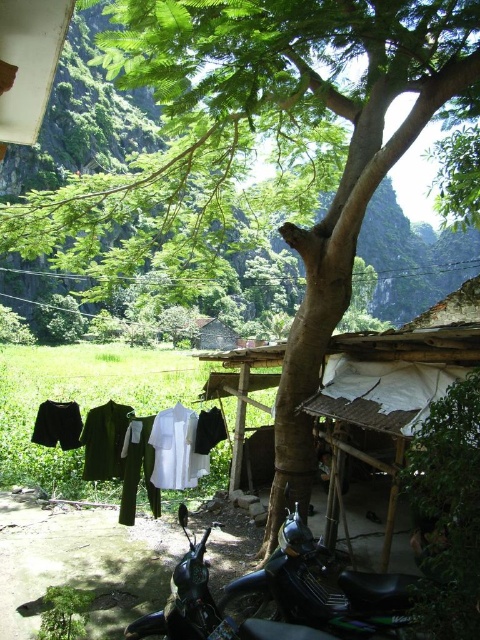
You are a visitor arriving at this rural area and need to park your car. You see the green matte motorcycle at lower center and the white cotton shirt at center. Which object is closer to the ground?

The green matte motorcycle at lower center is located below the white cotton shirt at center, so the green matte motorcycle at lower center is closer to the ground.

You are a delivery person who needs to park your motorcycle exactly at point 0.923, 0.671. You see the green matte motorcycle at lower center in the image. Is it currently occupying the exact spot you need to park?

The green matte motorcycle at lower center is positioned at point (322,589), so yes, it is currently occupying the exact spot you need to park.